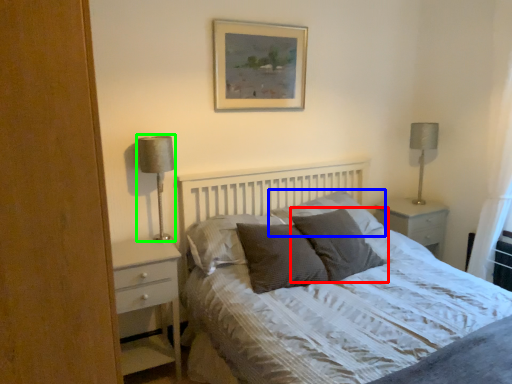
Question: Based on their relative distances, which object is nearer to pillow (highlighted by a red box)? Choose from pillow (highlighted by a blue box) and table lamp (highlighted by a green box).

Choices:
 (A) pillow
 (B) table lamp

Answer: (A)